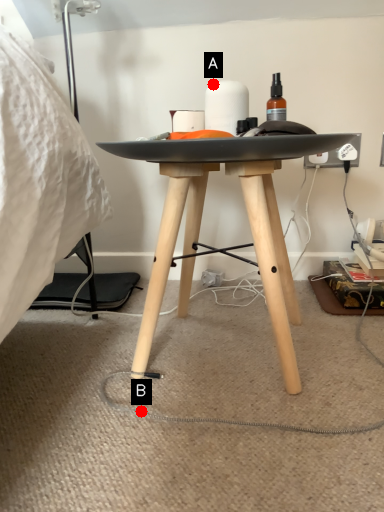
Question: Two points are circled on the image, labeled by A and B beside each circle. Which of the following is the farthest from the observer?

Choices:
 (A) A is further
 (B) B is further

Answer: (A)